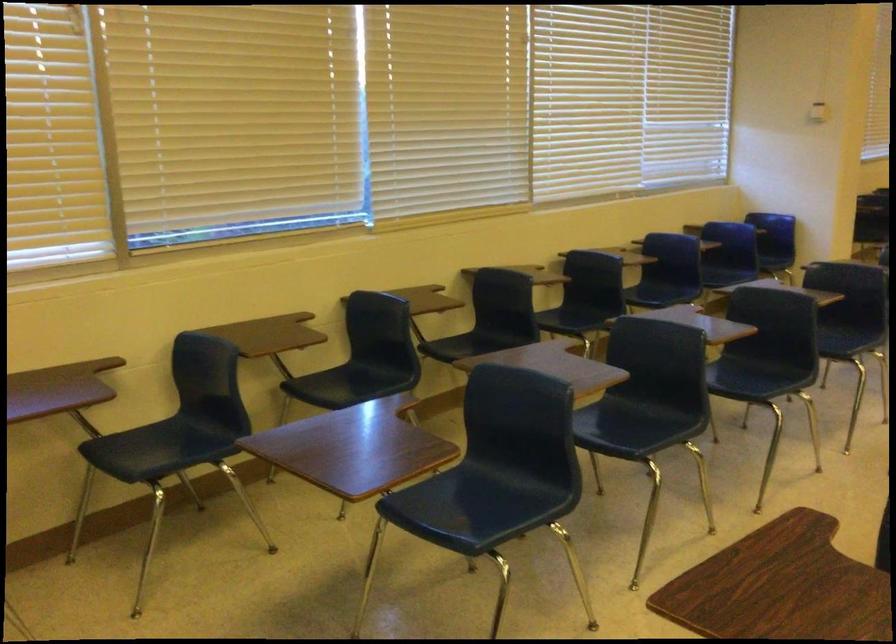
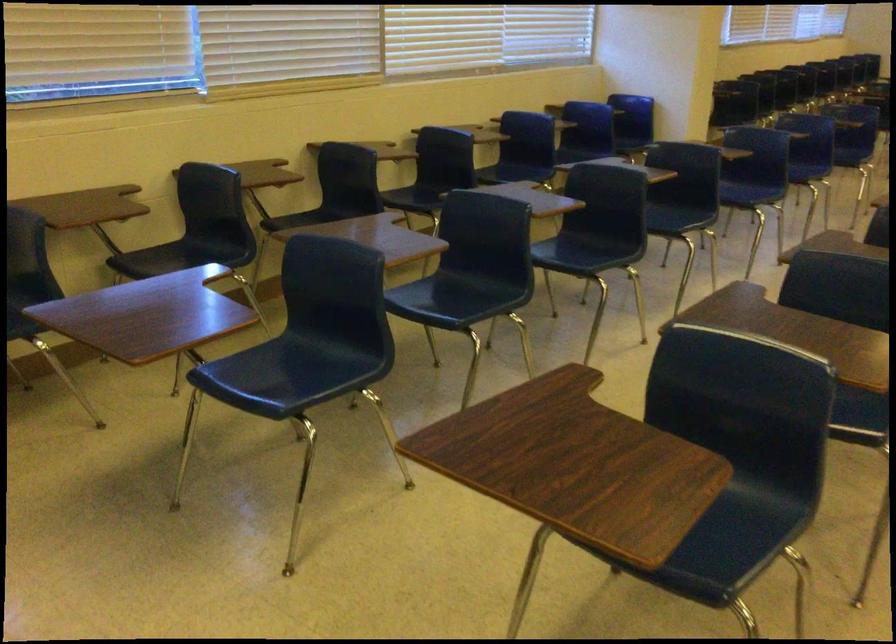
The point at (746, 375) is marked in the first image. Where is the corresponding point in the second image?

(586, 252)